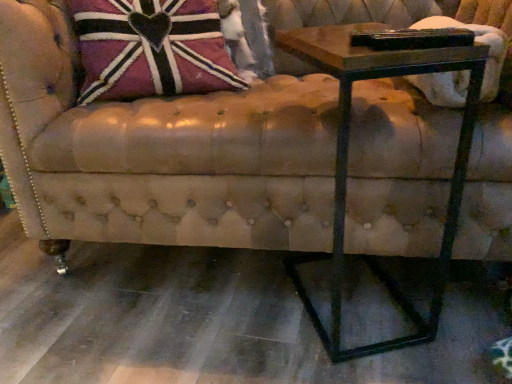
You are a GUI agent. You are given a task and a screenshot of the screen. Output one action in this format:
    pyautogui.click(x=<x>, y=<y>)
    Task: Click on the free location to the right of wooden table at right
    Image resolution: width=512 pixels, height=384 pixels.
    Given the screenshot: What is the action you would take?
    pyautogui.click(x=448, y=296)